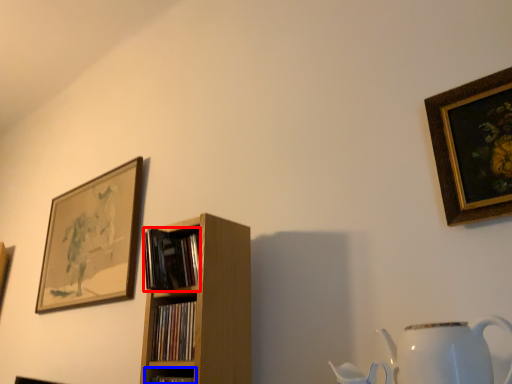
Question: Which object is closer to the camera taking this photo, book (highlighted by a red box) or shelf (highlighted by a blue box)?

Choices:
 (A) book
 (B) shelf

Answer: (B)